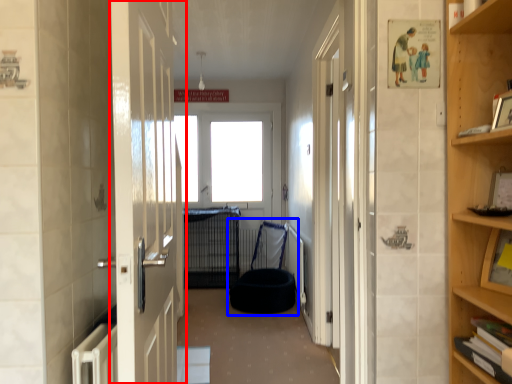
Question: Among these objects, which one is farthest to the camera, door (highlighted by a red box) or bean bag chair (highlighted by a blue box)?

Choices:
 (A) door
 (B) bean bag chair

Answer: (B)